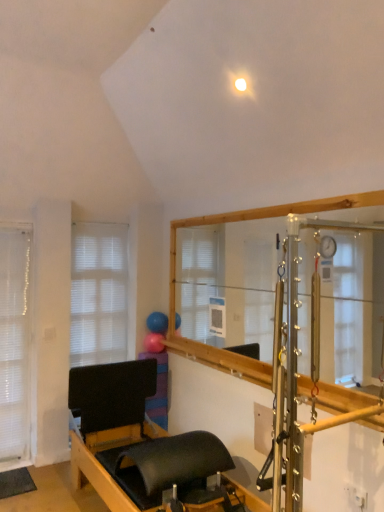
Question: Can you confirm if black matte bed frame at lower center is positioned to the right of white matte window at left?

Choices:
 (A) yes
 (B) no

Answer: (A)

Question: From a real-world perspective, is black matte bed frame at lower center physically above white matte window at left?

Choices:
 (A) yes
 (B) no

Answer: (B)

Question: Is black matte bed frame at lower center in front of white matte window at left?

Choices:
 (A) no
 (B) yes

Answer: (B)

Question: Can you confirm if black matte bed frame at lower center is wider than white matte window at left?

Choices:
 (A) yes
 (B) no

Answer: (A)

Question: Can you confirm if black matte bed frame at lower center is positioned to the left of white matte window at left?

Choices:
 (A) yes
 (B) no

Answer: (B)

Question: In terms of width, does blue rubber balloon at center, placed as the second balloon when sorted from bottom to top, look wider or thinner when compared to white sheer curtain at left?

Choices:
 (A) thin
 (B) wide

Answer: (B)

Question: Does point (160, 325) appear closer or farther from the camera than point (0, 302)?

Choices:
 (A) farther
 (B) closer

Answer: (A)

Question: From a real-world perspective, is blue rubber balloon at center, which ranks as the first balloon in top-to-bottom order, physically located above or below white sheer curtain at left?

Choices:
 (A) above
 (B) below

Answer: (A)

Question: Relative to white sheer curtain at left, is blue rubber balloon at center, placed as the second balloon when sorted from bottom to top, in front or behind?

Choices:
 (A) behind
 (B) front

Answer: (A)

Question: Is white sheer curtain at left bigger or smaller than black matte bed frame at lower center?

Choices:
 (A) small
 (B) big

Answer: (A)

Question: From a real-world perspective, is white sheer curtain at left positioned above or below black matte bed frame at lower center?

Choices:
 (A) above
 (B) below

Answer: (A)

Question: Considering the positions of white sheer curtain at left and black matte bed frame at lower center in the image, is white sheer curtain at left taller or shorter than black matte bed frame at lower center?

Choices:
 (A) short
 (B) tall

Answer: (B)

Question: In terms of width, does white sheer curtain at left look wider or thinner when compared to black matte bed frame at lower center?

Choices:
 (A) thin
 (B) wide

Answer: (A)

Question: Is point (155, 330) positioned closer to the camera than point (152, 493)?

Choices:
 (A) farther
 (B) closer

Answer: (A)

Question: From the image's perspective, is blue rubber balloon at center, which ranks as the first balloon in top-to-bottom order, above or below black matte bed frame at lower center?

Choices:
 (A) below
 (B) above

Answer: (B)